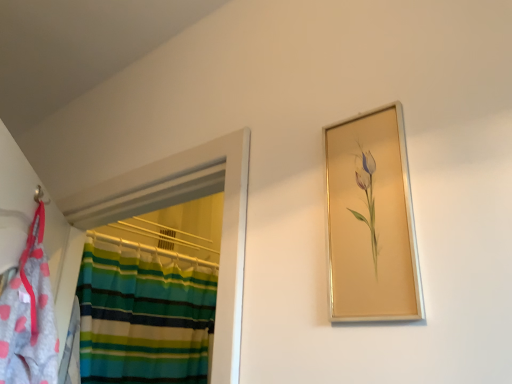
Describe the element at coordinates (371, 220) in the screenshot. I see `gold metallic picture frame at upper right` at that location.

What is the approximate width of gold metallic picture frame at upper right?

gold metallic picture frame at upper right is 0.99 inches wide.

Identify the location of gold metallic picture frame at upper right. (371, 220).

Where is `gold metallic picture frame at upper right`? The width and height of the screenshot is (512, 384). gold metallic picture frame at upper right is located at coordinates (371, 220).